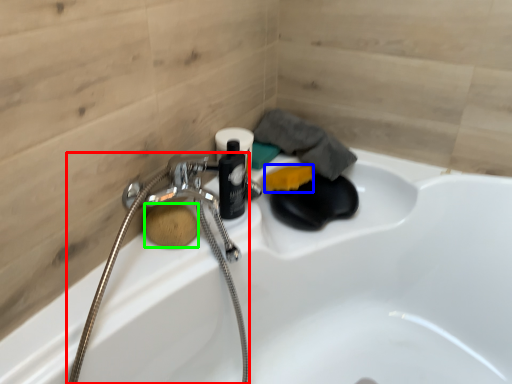
Question: Estimate the real-world distances between objects in this image. Which object is closer to garden hose (highlighted by a red box), soap (highlighted by a blue box) or soap (highlighted by a green box)?

Choices:
 (A) soap
 (B) soap

Answer: (B)